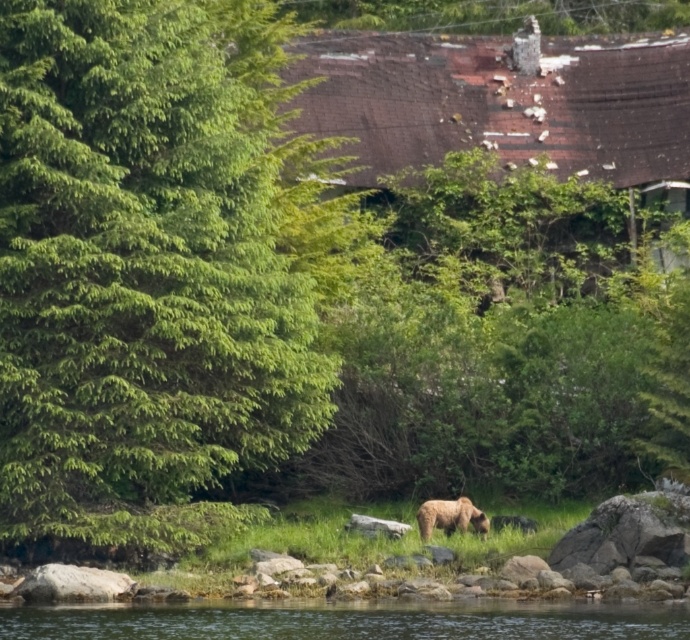
Question: Which point is farther from the camera taking this photo?

Choices:
 (A) (680, 131)
 (B) (462, 528)
 (C) (124, 99)

Answer: (A)

Question: Can you confirm if green leafy tree at center is positioned above clear water at lower center?

Choices:
 (A) yes
 (B) no

Answer: (A)

Question: Where is brown shingles at upper center located in relation to fuzzy brown bear at lower center in the image?

Choices:
 (A) left
 (B) right

Answer: (B)

Question: Among these objects, which one is farthest from the camera?

Choices:
 (A) fuzzy brown bear at lower center
 (B) green leafy tree at center
 (C) brown shingles at upper center

Answer: (C)

Question: Where is green leafy tree at center located in relation to fuzzy brown bear at lower center in the image?

Choices:
 (A) above
 (B) below

Answer: (A)

Question: Which of the following is the farthest from the observer?

Choices:
 (A) clear water at lower center
 (B) fuzzy brown bear at lower center
 (C) brown shingles at upper center
 (D) green leafy tree at center

Answer: (C)